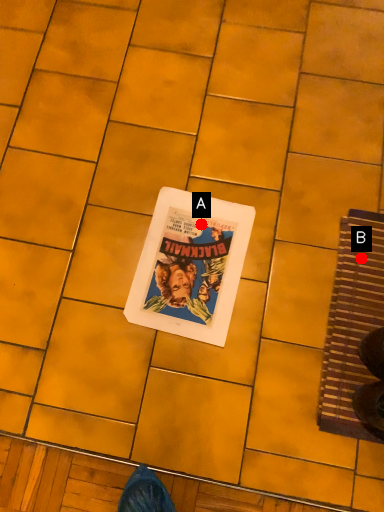
Question: Two points are circled on the image, labeled by A and B beside each circle. Which point appears closest to the camera in this image?

Choices:
 (A) A is closer
 (B) B is closer

Answer: (B)